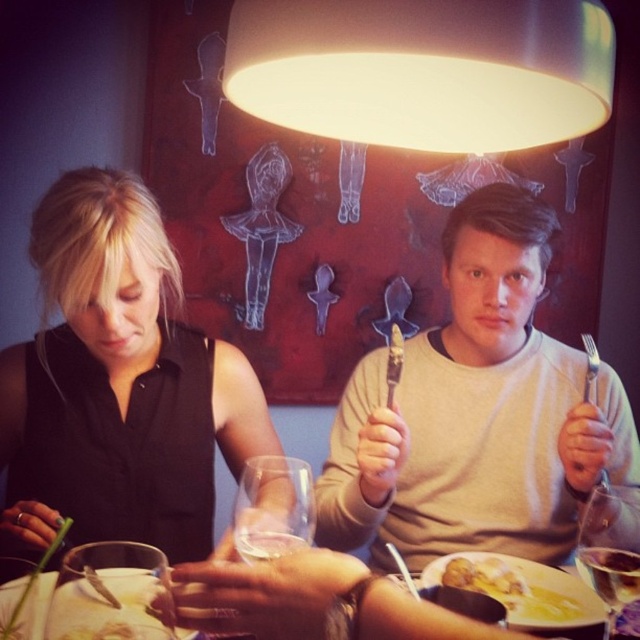
Question: Is the position of clear glass wine glass at lower left less distant than that of transparent glass at lower right?

Choices:
 (A) no
 (B) yes

Answer: (B)

Question: Among these objects, which one is farthest from the camera?

Choices:
 (A) transparent glass at lower center
 (B) yellow creamy soup at lower center
 (C) transparent glass at lower right
 (D) clear glass wine glass at lower left

Answer: (B)

Question: Which of the following is the closest to the observer?

Choices:
 (A) (278, 554)
 (B) (588, 529)

Answer: (A)

Question: Is black matte dress at center thinner than yellow creamy soup at lower center?

Choices:
 (A) no
 (B) yes

Answer: (A)

Question: In this image, where is black matte dress at center located relative to transparent glass at lower right?

Choices:
 (A) left
 (B) right

Answer: (A)

Question: Among these objects, which one is farthest from the camera?

Choices:
 (A) white matte lampshade at upper center
 (B) yellow creamy soup at lower center

Answer: (B)